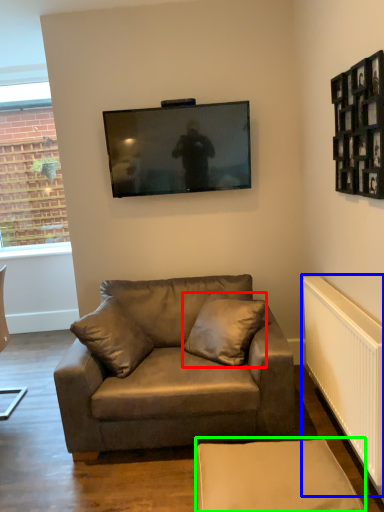
Question: Which object is positioned closest to pillow (highlighted by a red box)? Select from radiator (highlighted by a blue box) and swivel chair (highlighted by a green box).

Choices:
 (A) radiator
 (B) swivel chair

Answer: (A)